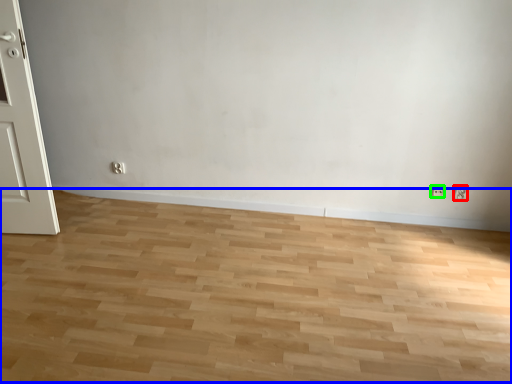
Question: Estimate the real-world distances between objects in this image. Which object is closer to electric outlet (highlighted by a red box), plain (highlighted by a blue box) or electric outlet (highlighted by a green box)?

Choices:
 (A) plain
 (B) electric outlet

Answer: (B)